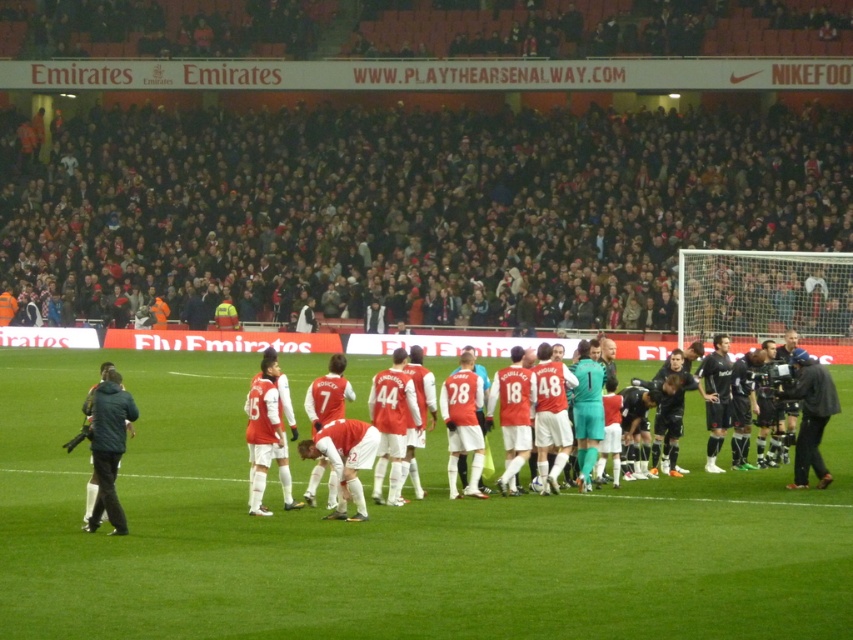
You are a photographer at the stadium and want to capture both the green grass field at center and the red matte jersey at center in a single shot. Which object should you focus on first to ensure both are in frame?

The green grass field at center has a smaller size compared to red matte jersey at center, so you should focus on the larger red matte jersey at center first to ensure both fit within the frame.

You are a photographer standing at the edge of the field. You want to take a photo that includes both the red matte jersey at center and the black leather jacket at right. If your camera has a maximum focus range of 7 feet, will you be able to capture both in focus?

The red matte jersey at center and the black leather jacket at right are 6.97 feet apart from each other, so yes, the camera can capture both in focus since the distance is within the 7 feet range.